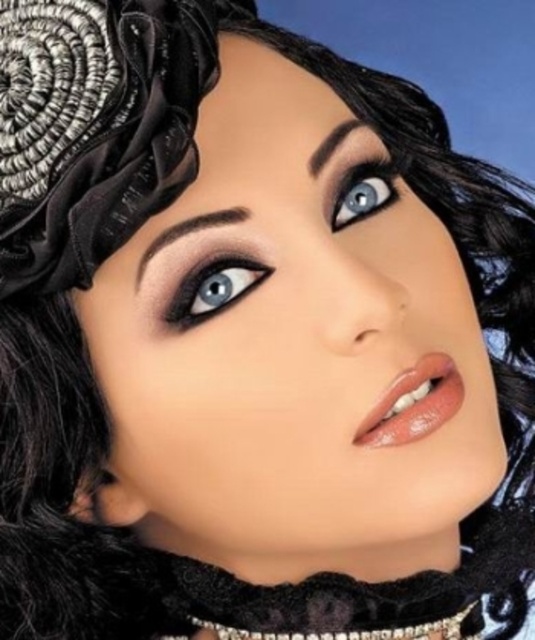
You are an artist analyzing the portrait. You need to determine the spatial relationship between the satin black headdress at upper left and the blue glossy eye at upper center. Which object is positioned closer to you?

The satin black headdress at upper left is closer to the viewer than the blue glossy eye at upper center.

You are a makeup artist preparing for a photoshoot. You have a client whose face is adorned with a satin black headdress at upper left and a blue glossy eye at upper center. The client wants to know which accessory takes up more space on their face. Which one is larger?

The satin black headdress at upper left is larger in size compared to the blue glossy eye at upper center, so it takes up more space on the client face.

You are a makeup artist analyzing the portrait. The scene shows a person with striking makeup and styled hair. You notice the satin black headdress at upper left and the smokey matte eye at center. Which object is located more to the left?

The satin black headdress at upper left is positioned more to the left than the smokey matte eye at center.